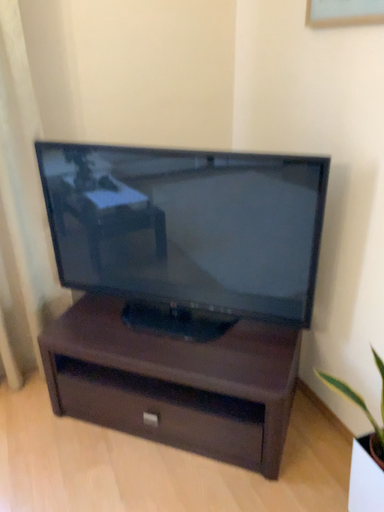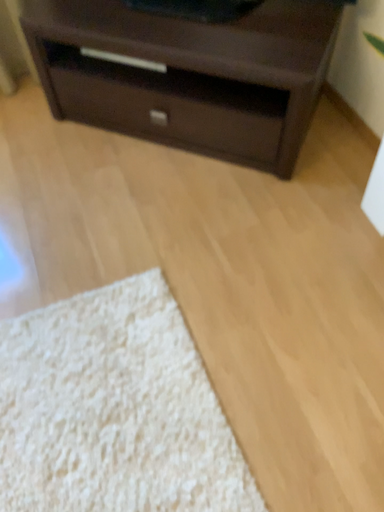
Question: Which way did the camera rotate in the video?

Choices:
 (A) rotated upward
 (B) rotated downward

Answer: (B)